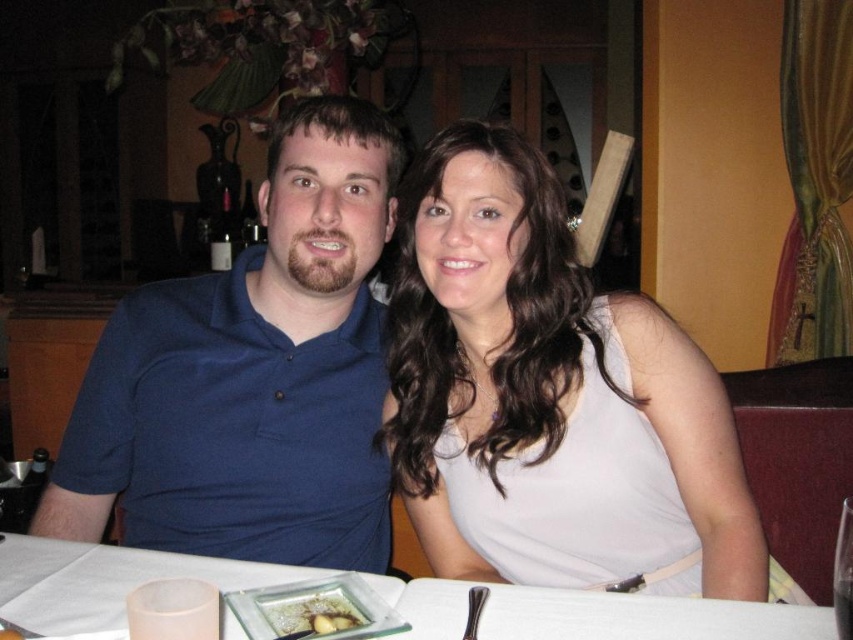
Can you confirm if blue cotton polo shirt at left is thinner than matte white dress at center?

In fact, blue cotton polo shirt at left might be wider than matte white dress at center.

Measure the distance between blue cotton polo shirt at left and camera.

1.22 meters

Locate an element on the screen. The width and height of the screenshot is (853, 640). blue cotton polo shirt at left is located at coordinates (252, 376).

Between point (405, 609) and point (337, 611), which one is positioned in front?

Positioned in front is point (337, 611).

Which is above, white paper napkin at center or slightly browned bread at center?

Positioned higher is slightly browned bread at center.

This screenshot has height=640, width=853. Identify the location of white paper napkin at center. (105, 580).

In order to click on white paper napkin at center in this screenshot , I will do `click(105, 580)`.

Can you confirm if blue cotton polo shirt at left is thinner than slightly browned bread at center?

No, blue cotton polo shirt at left is not thinner than slightly browned bread at center.

Which of these two, blue cotton polo shirt at left or slightly browned bread at center, stands taller?

With more height is blue cotton polo shirt at left.

Find the location of a particular element. blue cotton polo shirt at left is located at coordinates (252, 376).

The height and width of the screenshot is (640, 853). What are the coordinates of `blue cotton polo shirt at left` in the screenshot? It's located at (252, 376).